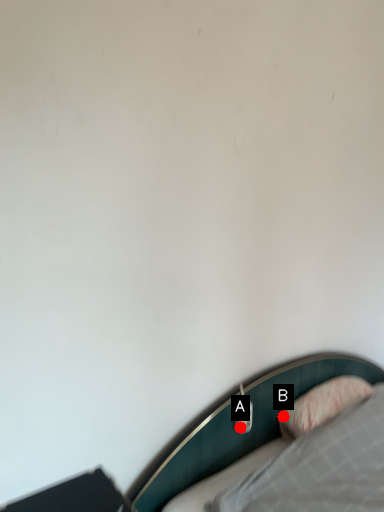
Question: Two points are circled on the image, labeled by A and B beside each circle. Among these points, which one is nearest to the camera?

Choices:
 (A) A is closer
 (B) B is closer

Answer: (A)